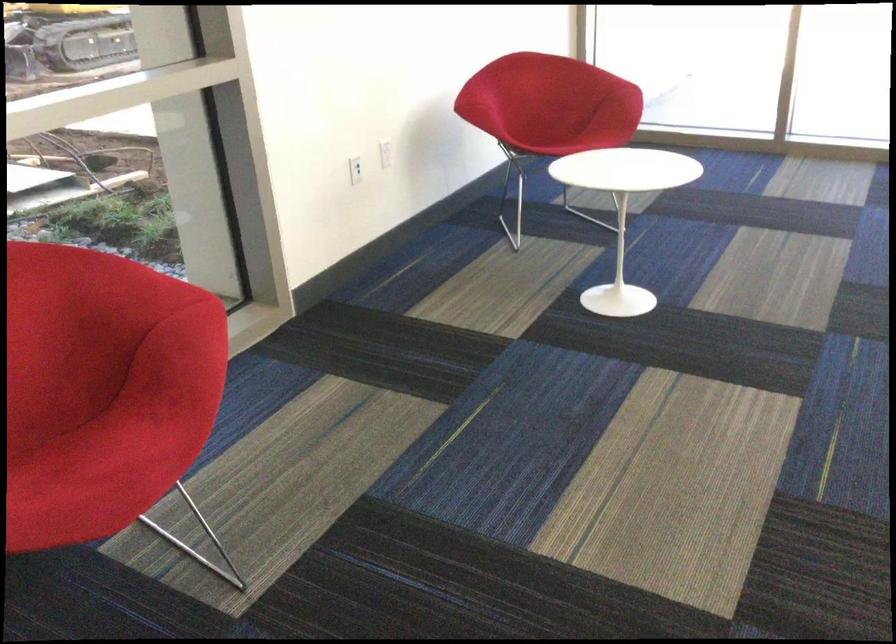
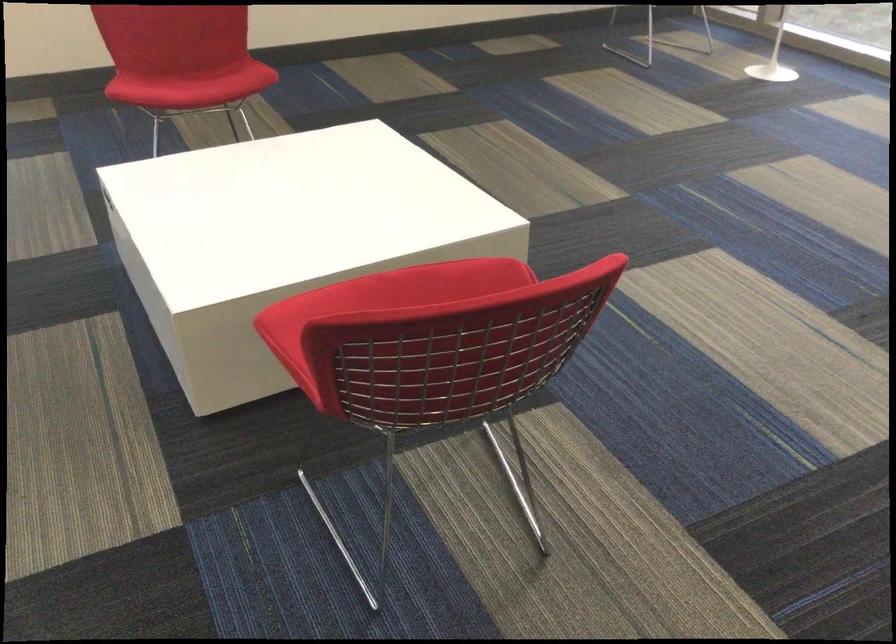
Question: The camera is either moving clockwise (left) or counter-clockwise (right) around the object. The first image is from the beginning of the video and the second image is from the end. Is the camera moving left or right when shooting the video?

Choices:
 (A) Left
 (B) Right

Answer: (A)